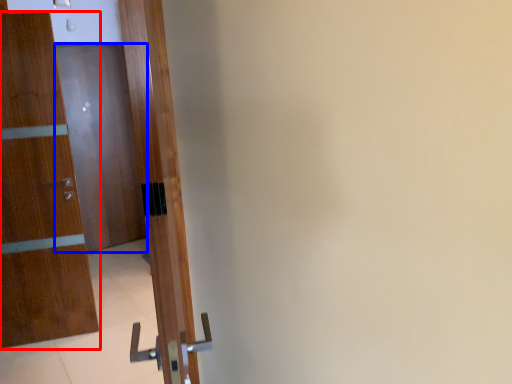
Question: Which of the following is the farthest to the observer, door (highlighted by a red box) or door (highlighted by a blue box)?

Choices:
 (A) door
 (B) door

Answer: (B)